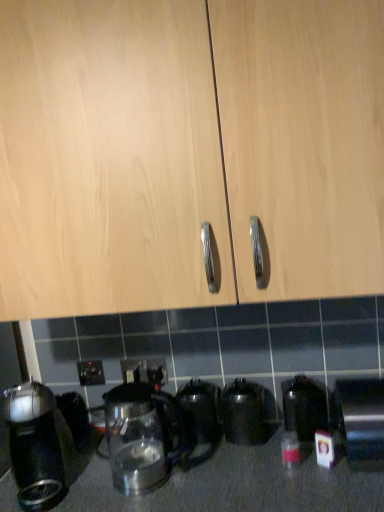
Question: Is satin silver toaster at lower right, which ranks as the 1th kitchen appliance in right-to-left order, at the right side of transparent glass kettle at center, marked as the 3th kitchen appliance in a left-to-right arrangement?

Choices:
 (A) no
 (B) yes

Answer: (B)

Question: Is satin silver toaster at lower right, which is the 6th kitchen appliance from left to right, thinner than transparent glass kettle at center, which appears as the 4th kitchen appliance when viewed from the right?

Choices:
 (A) yes
 (B) no

Answer: (B)

Question: Could transparent glass kettle at center, marked as the 3th kitchen appliance in a left-to-right arrangement, be considered to be inside satin silver toaster at lower right, which is the 6th kitchen appliance from left to right?

Choices:
 (A) yes
 (B) no

Answer: (B)

Question: Is satin silver toaster at lower right, which ranks as the 1th kitchen appliance in right-to-left order, shorter than transparent glass kettle at center, marked as the 3th kitchen appliance in a left-to-right arrangement?

Choices:
 (A) no
 (B) yes

Answer: (A)

Question: Is satin silver toaster at lower right, which is the 6th kitchen appliance from left to right, not close to transparent glass kettle at center, marked as the 3th kitchen appliance in a left-to-right arrangement?

Choices:
 (A) yes
 (B) no

Answer: (B)

Question: Looking at their shapes, would you say light wood cabinet at center is wider or thinner than transparent glass kettle at center, which appears as the 4th kitchen appliance when viewed from the right?

Choices:
 (A) wide
 (B) thin

Answer: (A)

Question: Is light wood cabinet at center bigger or smaller than transparent glass kettle at center, marked as the 3th kitchen appliance in a left-to-right arrangement?

Choices:
 (A) big
 (B) small

Answer: (A)

Question: Is light wood cabinet at center in front of or behind transparent glass kettle at center, marked as the 3th kitchen appliance in a left-to-right arrangement, in the image?

Choices:
 (A) front
 (B) behind

Answer: (A)

Question: Which is correct: light wood cabinet at center is inside transparent glass kettle at center, marked as the 3th kitchen appliance in a left-to-right arrangement, or outside of it?

Choices:
 (A) outside
 (B) inside

Answer: (A)

Question: Relative to transparent glass kettle at lower center, the second kitchen appliance when ordered from right to left, is black plastic coffee maker at left, acting as the 6th kitchen appliance starting from the right, in front or behind?

Choices:
 (A) front
 (B) behind

Answer: (A)

Question: Considering the positions of black plastic coffee maker at left, acting as the 6th kitchen appliance starting from the right, and transparent glass kettle at lower center, the second kitchen appliance when ordered from right to left, in the image, is black plastic coffee maker at left, acting as the 6th kitchen appliance starting from the right, taller or shorter than transparent glass kettle at lower center, the second kitchen appliance when ordered from right to left,?

Choices:
 (A) short
 (B) tall

Answer: (B)

Question: From a real-world perspective, relative to transparent glass kettle at lower center, the second kitchen appliance when ordered from right to left, is black plastic coffee maker at left, positioned as the first kitchen appliance in left-to-right order, vertically above or below?

Choices:
 (A) above
 (B) below

Answer: (A)

Question: Considering the positions of point (36, 504) and point (322, 425), is point (36, 504) closer or farther from the camera than point (322, 425)?

Choices:
 (A) farther
 (B) closer

Answer: (B)

Question: Is black plastic electric outlet at lower center, the third electric outlet viewed from the right, inside the boundaries of black plastic coffee maker at left, positioned as the first kitchen appliance in left-to-right order, or outside?

Choices:
 (A) inside
 (B) outside

Answer: (B)

Question: Considering the relative positions of black plastic electric outlet at lower center, the third electric outlet viewed from the right, and black plastic coffee maker at left, acting as the 6th kitchen appliance starting from the right, in the image provided, is black plastic electric outlet at lower center, the third electric outlet viewed from the right, to the left or to the right of black plastic coffee maker at left, acting as the 6th kitchen appliance starting from the right,?

Choices:
 (A) right
 (B) left

Answer: (A)